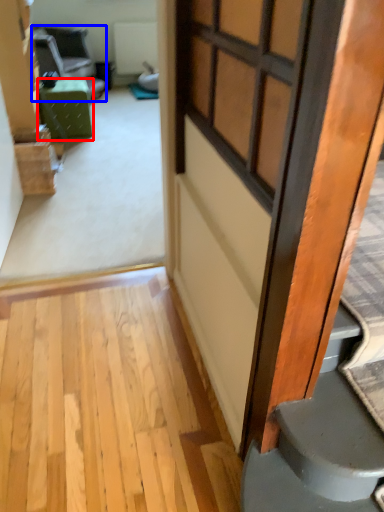
Question: Which point is further to the camera, furniture (highlighted by a red box) or chair (highlighted by a blue box)?

Choices:
 (A) furniture
 (B) chair

Answer: (B)